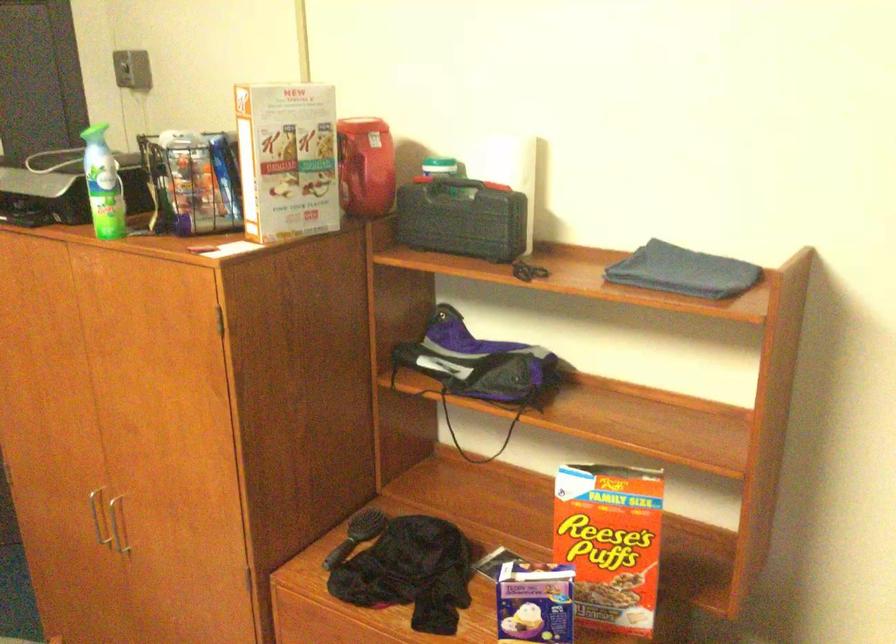
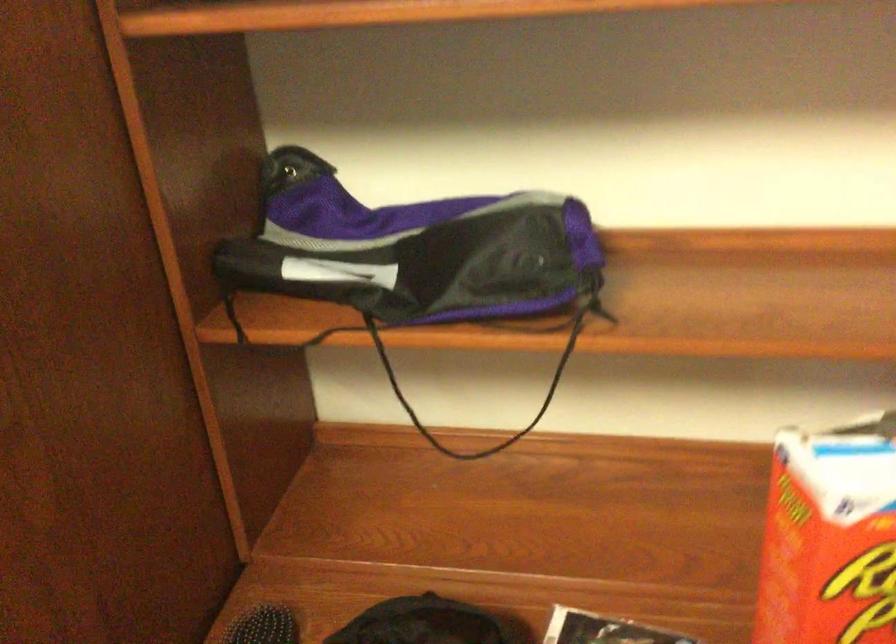
Question: I am providing you with two images of the same scene from different viewpoints. Which of the following objects are not visible in image2?

Choices:
 (A) red cereal box
 (B) purple and black bag
 (C) black bag drawstring
 (D) none of these

Answer: (D)